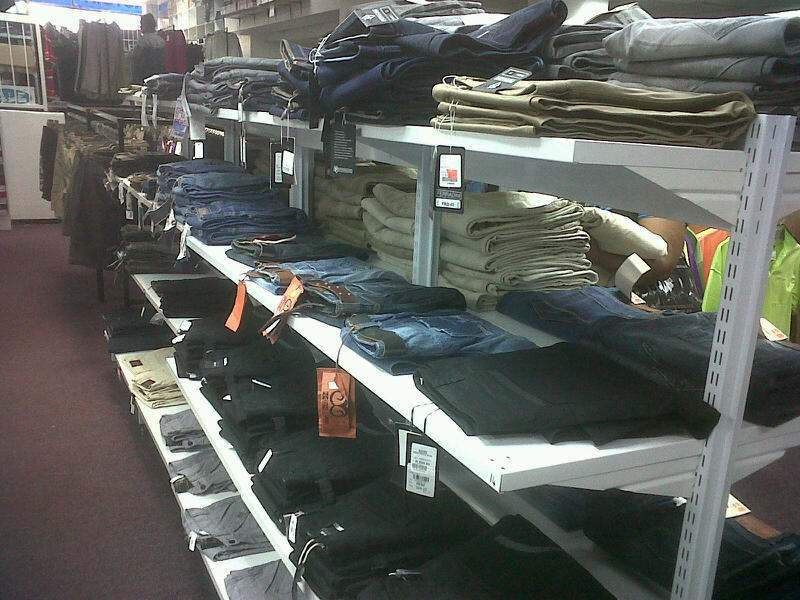
At what (x,y) coordinates should I click in order to perform the action: click on burgundy carpet. Please return your answer as a coordinate pair (x, y). The image size is (800, 600). Looking at the image, I should click on (100, 468).